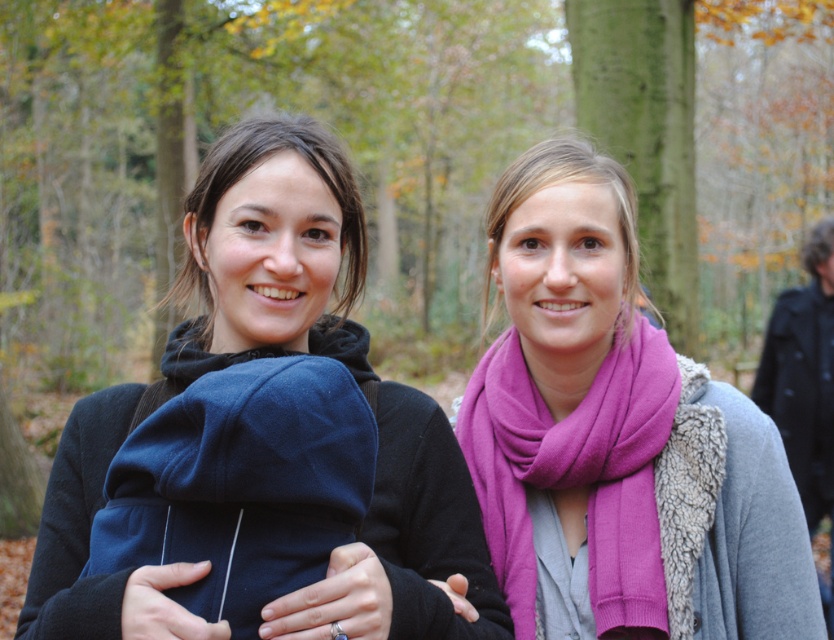
You are standing in a forest during autumn and want to take a photo of the point at coordinates (651, 536). If your camera has a maximum focus range of 7 feet, will it be able to capture the point clearly?

The point at coordinates (651, 536) is 7.23 feet away from the camera. Since the camera can only focus up to 7 feet, it will not be able to capture the point clearly.

You are a photographer trying to capture both the matte black jacket at left and the purple woolen scarf at center in a single frame. Based on their positions and sizes, will you need to adjust your camera angle to ensure both are fully visible?

The matte black jacket at left might be wider than purple woolen scarf at center, so you may need to adjust your camera angle to ensure both are fully visible in the frame.

From the picture: You are a photographer trying to capture a closeup of the purple scarf at center and the matte black jacket at left in the image. Which object should you zoom in on to ensure it takes up more of the frame without moving the camera?

The matte black jacket at left occupies more space in the image than the purple scarf at center, so you should zoom in on the matte black jacket at left to capture it taking up more of the frame.